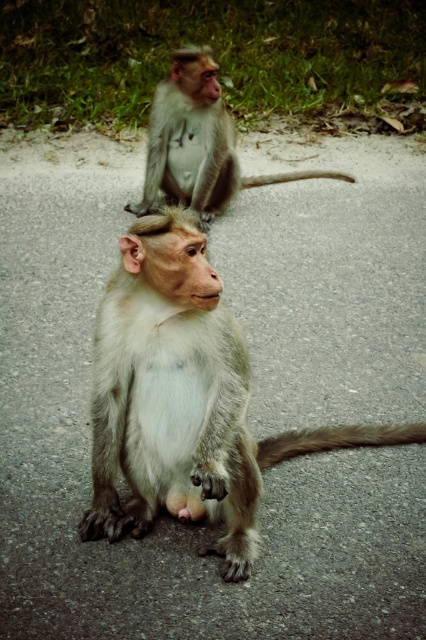
Based on the photo, which is above, gray furry monkey at center or gray fur monkey at upper center?

gray fur monkey at upper center is higher up.

Where is `gray furry monkey at center`? This screenshot has height=640, width=426. gray furry monkey at center is located at coordinates (184, 397).

Identify the location of gray furry monkey at center. Image resolution: width=426 pixels, height=640 pixels. (184, 397).